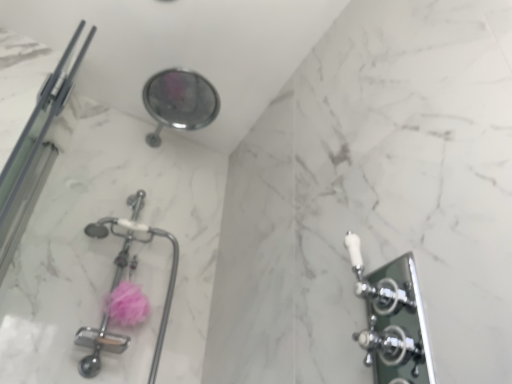
What is the approximate width of chrome/polished metal faucet at upper right?

1.58 inches.

Describe the element at coordinates (392, 320) in the screenshot. I see `chrome/polished metal faucet at upper right` at that location.

This screenshot has height=384, width=512. Find the location of `chrome/polished metal faucet at upper right`. chrome/polished metal faucet at upper right is located at coordinates (392, 320).

You are a GUI agent. You are given a task and a screenshot of the screen. Output one action in this format:
    pyautogui.click(x=<x>, y=<y>)
    Task: Click on the chrome/polished metal faucet at upper right
    The image size is (512, 384).
    Given the screenshot: What is the action you would take?
    pyautogui.click(x=392, y=320)